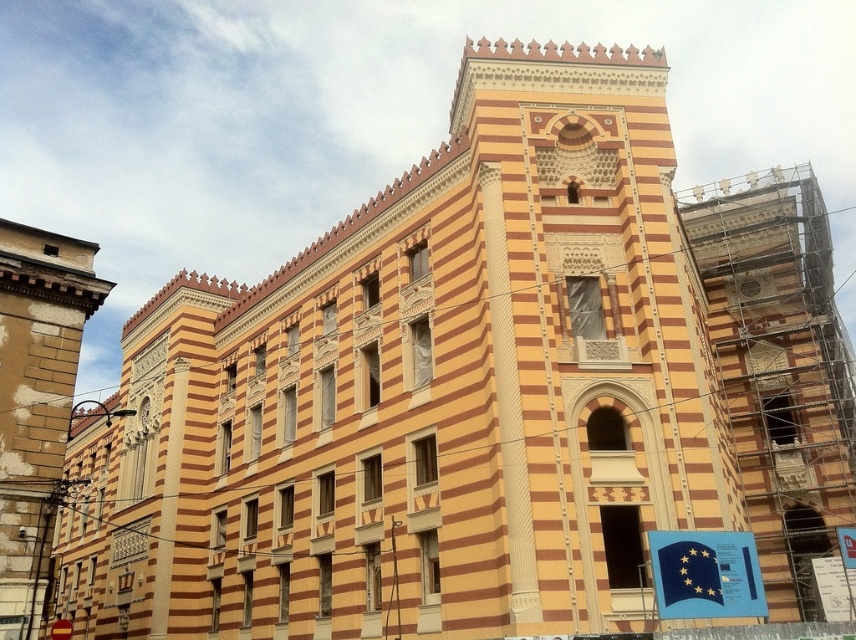
Who is lower down, scaffolding at right or metallic gold clock at upper right?

metallic gold clock at upper right

Does scaffolding at right have a lesser width compared to metallic gold clock at upper right?

In fact, scaffolding at right might be wider than metallic gold clock at upper right.

Which is in front, point (728, 248) or point (740, 282)?

Point (728, 248) is in front.

The width and height of the screenshot is (856, 640). What are the coordinates of `scaffolding at right` in the screenshot? It's located at (780, 371).

Does point (728, 616) come behind point (744, 291)?

That is False.

Does blue paper flag at lower right have a larger size compared to metallic gold clock at upper right?

Indeed, blue paper flag at lower right has a larger size compared to metallic gold clock at upper right.

At what (x,y) coordinates should I click in order to perform the action: click on blue paper flag at lower right. Please return your answer as a coordinate pair (x, y). Looking at the image, I should click on [x=705, y=573].

You are a GUI agent. You are given a task and a screenshot of the screen. Output one action in this format:
    pyautogui.click(x=<x>, y=<y>)
    Task: Click on the blue paper flag at lower right
    Image resolution: width=856 pixels, height=640 pixels.
    Given the screenshot: What is the action you would take?
    pyautogui.click(x=705, y=573)

In the scene shown: Does scaffolding at right have a lesser height compared to blue paper flag at lower right?

No, scaffolding at right is not shorter than blue paper flag at lower right.

In the scene shown: Is scaffolding at right positioned at the back of blue paper flag at lower right?

Yes, it is behind blue paper flag at lower right.

What do you see at coordinates (780, 371) in the screenshot? This screenshot has height=640, width=856. I see `scaffolding at right` at bounding box center [780, 371].

Where is `scaffolding at right`? scaffolding at right is located at coordinates (780, 371).